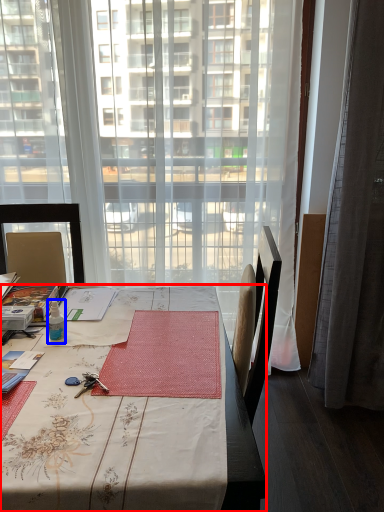
Question: Which object is closer to the camera taking this photo, desk (highlighted by a red box) or bottle (highlighted by a blue box)?

Choices:
 (A) desk
 (B) bottle

Answer: (A)